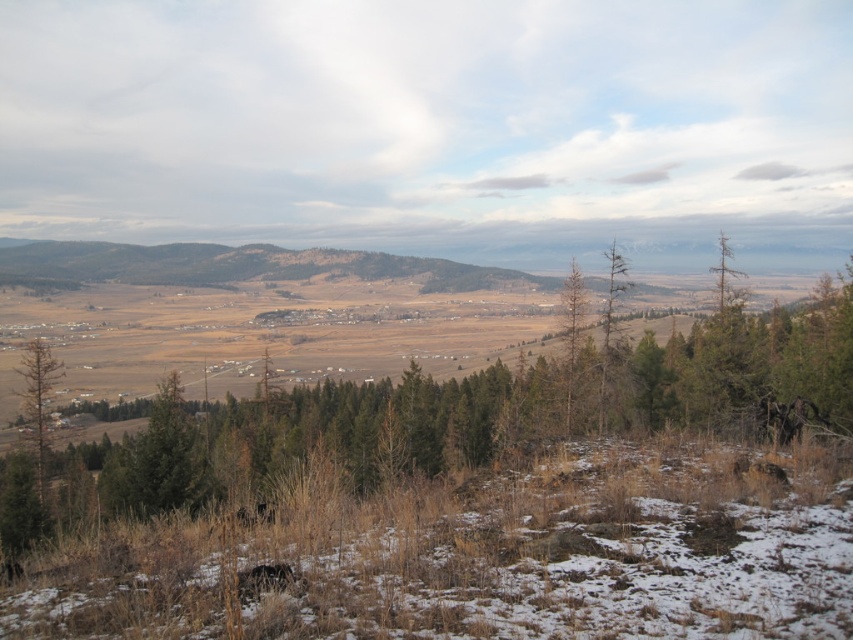
Question: Which point is closer to the camera taking this photo?

Choices:
 (A) tap(270, 486)
 (B) tap(39, 497)

Answer: (A)

Question: Is green matte tree at center below green matte tree at left?

Choices:
 (A) no
 (B) yes

Answer: (A)

Question: Does green matte tree at center lie behind green matte tree at left?

Choices:
 (A) yes
 (B) no

Answer: (B)

Question: Which object appears closest to the camera in this image?

Choices:
 (A) green matte tree at center
 (B) green matte tree at left

Answer: (A)

Question: Which of the following is the closest to the observer?

Choices:
 (A) (32, 506)
 (B) (38, 362)

Answer: (A)

Question: Does green matte tree at center appear on the left side of green matte tree at left?

Choices:
 (A) no
 (B) yes

Answer: (A)